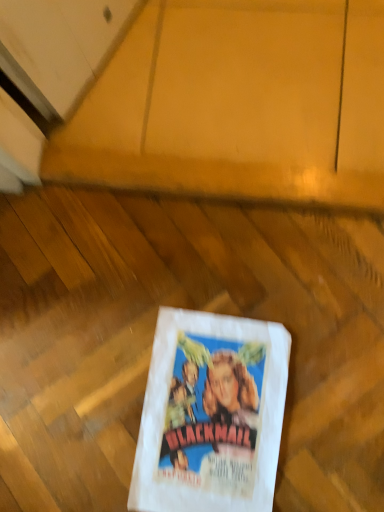
This screenshot has height=512, width=384. Find the location of `white paper at center`. white paper at center is located at coordinates (211, 414).

What do you see at coordinates (211, 414) in the screenshot? This screenshot has height=512, width=384. I see `white paper at center` at bounding box center [211, 414].

Measure the distance between point (273, 380) and camera.

The depth of point (273, 380) is 25.51 inches.

Identify the location of white paper at center. (211, 414).